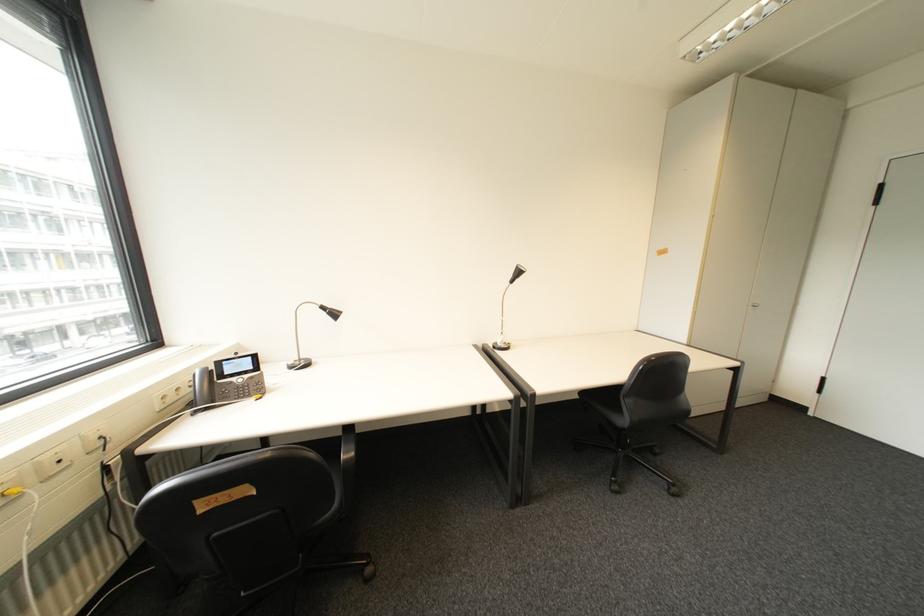
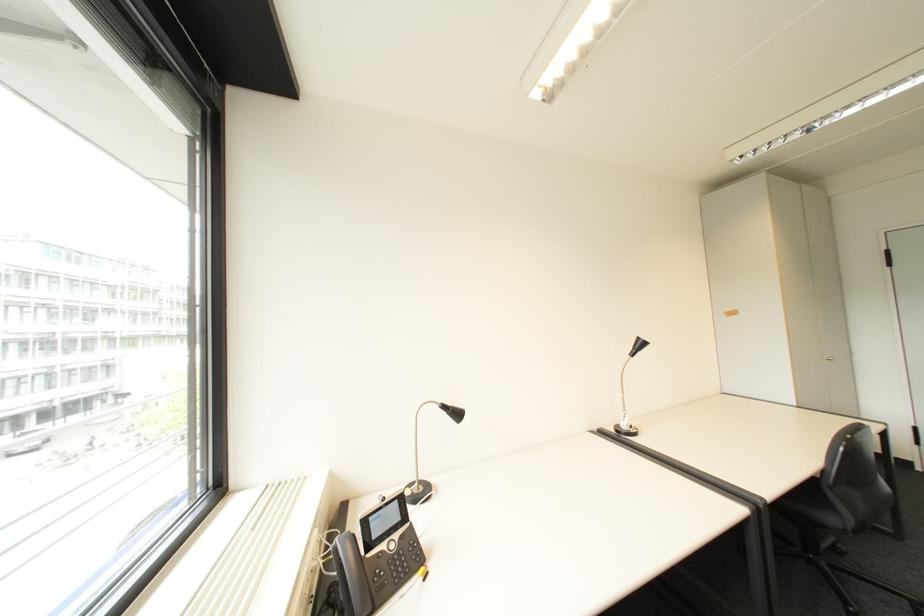
The point at (334, 309) is marked in the first image. Where is the corresponding point in the second image?

(455, 407)